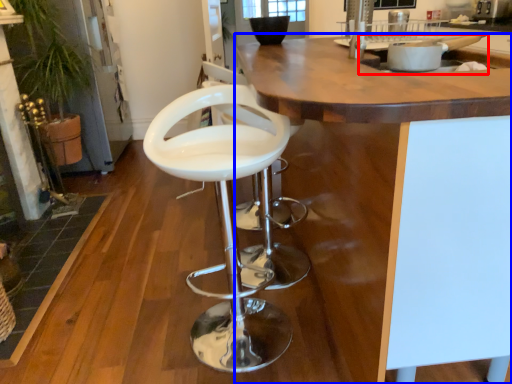
Question: Among these objects, which one is farthest to the camera, sink (highlighted by a red box) or countertop (highlighted by a blue box)?

Choices:
 (A) sink
 (B) countertop

Answer: (A)